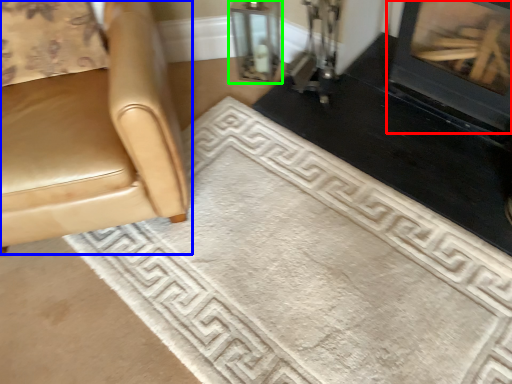
Question: Estimate the real-world distances between objects in this image. Which object is farther from fireplace (highlighted by a red box), chair (highlighted by a blue box) or glass door (highlighted by a green box)?

Choices:
 (A) chair
 (B) glass door

Answer: (A)